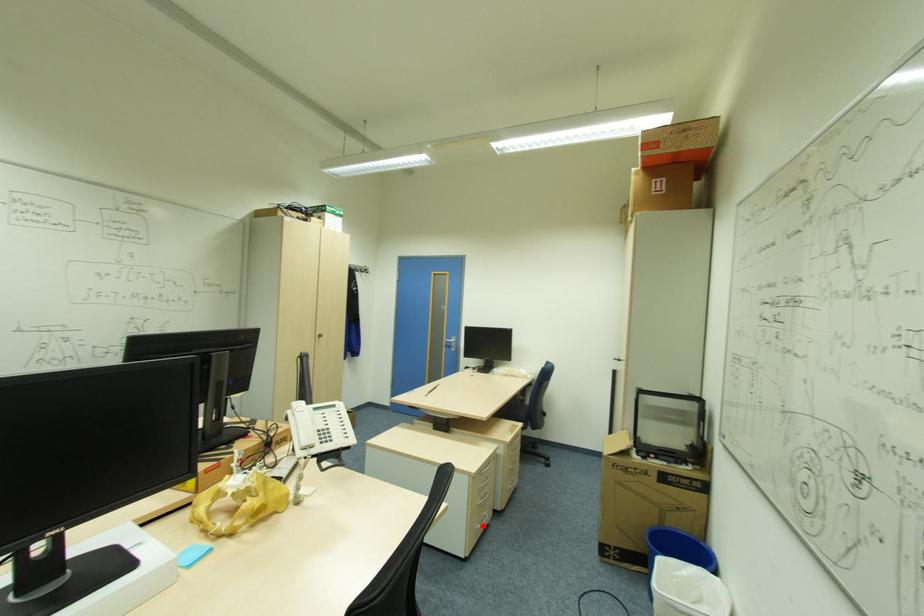
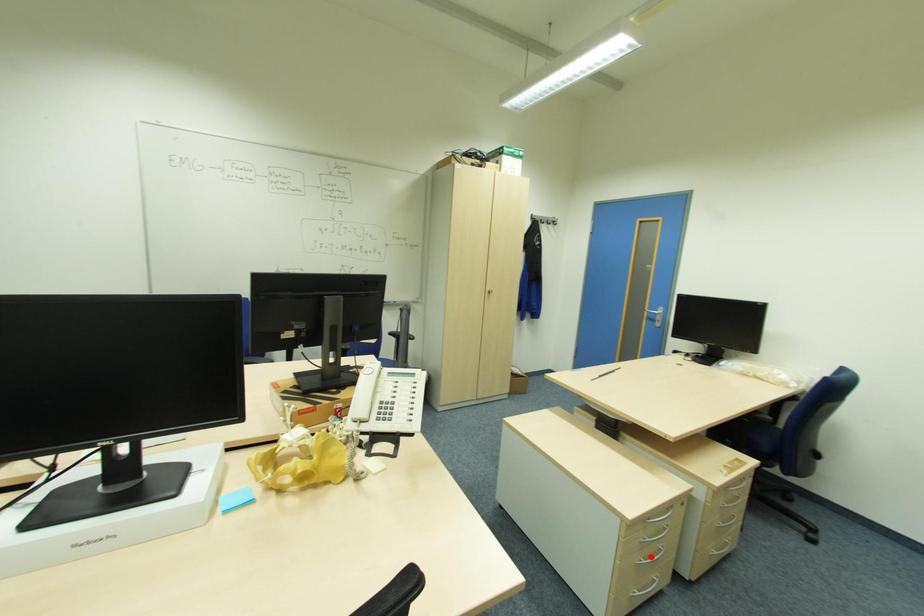
I am providing you with two images of the same scene from different viewpoints. A red point is marked on the first image and another point is marked on the second image. Are the points marked in image1 and image2 representing the same 3D position?

No